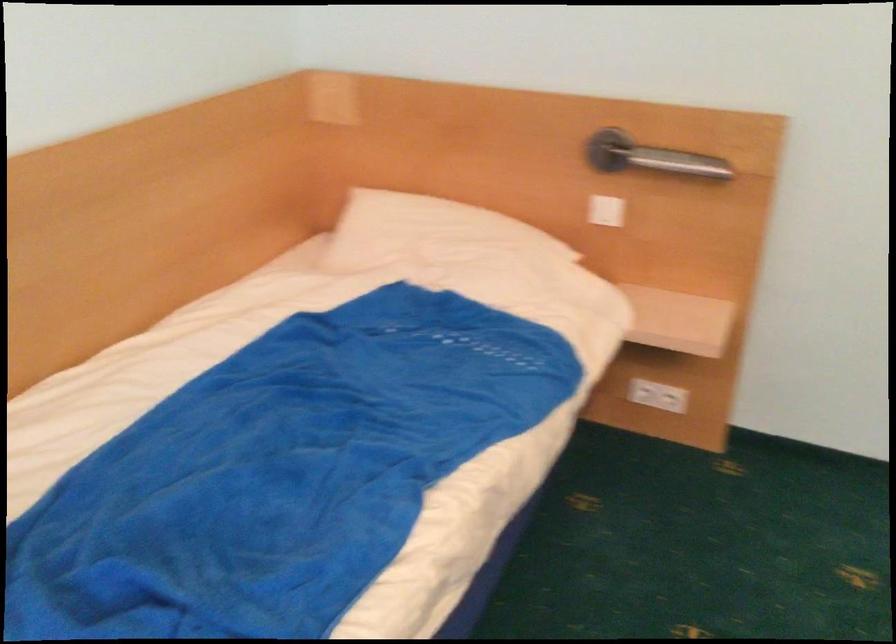
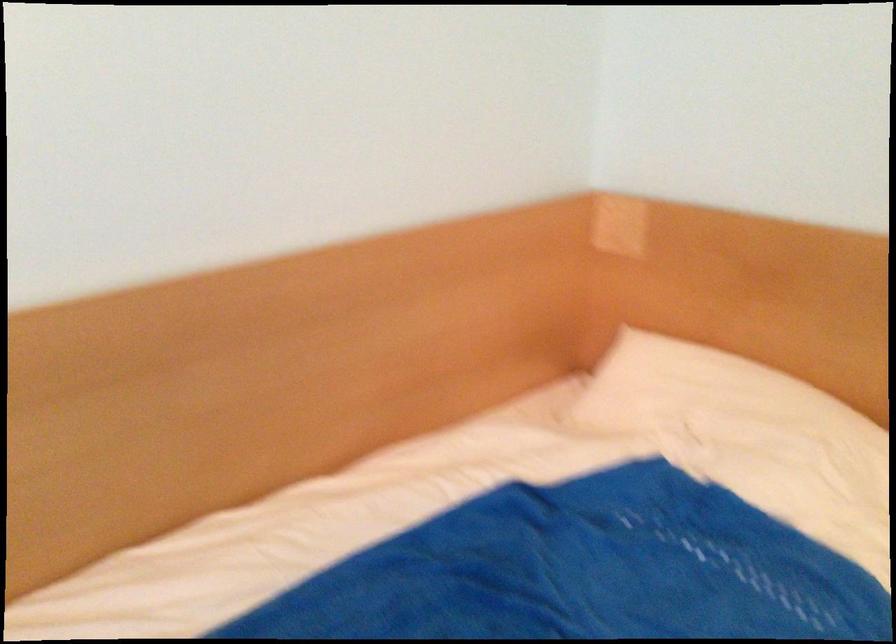
In the second image, find the point that corresponds to point 425,229 in the first image.

(707, 391)